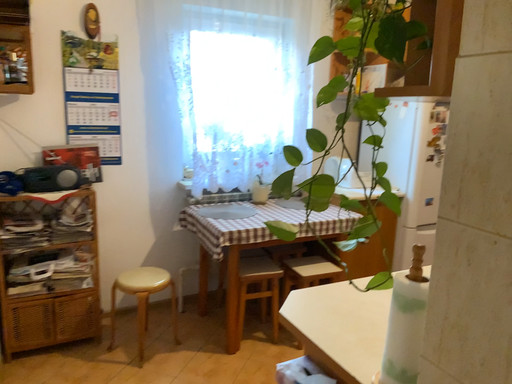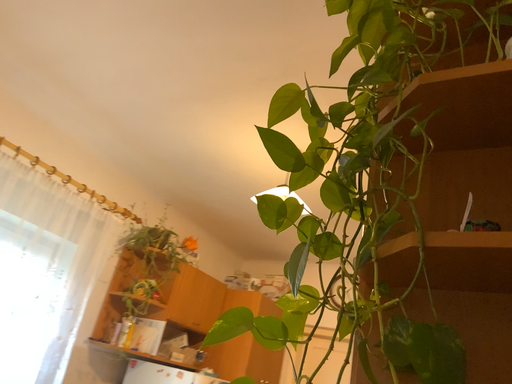
Question: How did the camera likely rotate when shooting the video?

Choices:
 (A) rotated downward
 (B) rotated upward

Answer: (B)